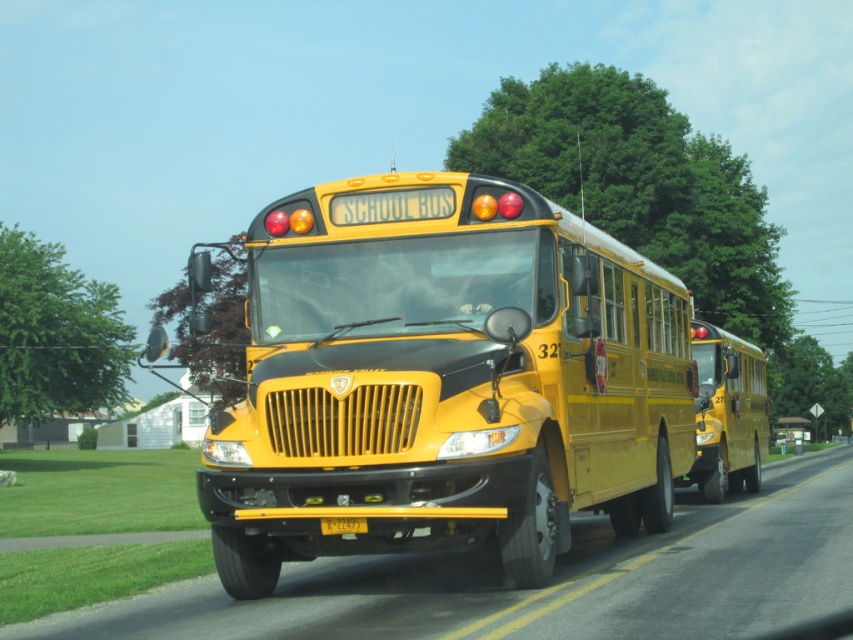
Question: Is yellow matte/solid school bus at center to the right of yellow matte school bus at center from the viewer's perspective?

Choices:
 (A) no
 (B) yes

Answer: (A)

Question: Which point is farther from the camera taking this photo?

Choices:
 (A) (323, 248)
 (B) (322, 522)

Answer: (A)

Question: Which is nearer to the yellow matte/solid school bus at center?

Choices:
 (A) yellow matte license plate at center
 (B) yellow matte school bus at center

Answer: (A)

Question: Is the position of yellow matte/solid school bus at center less distant than that of yellow matte license plate at center?

Choices:
 (A) no
 (B) yes

Answer: (B)

Question: Which object appears farthest from the camera in this image?

Choices:
 (A) yellow matte/solid school bus at center
 (B) yellow matte school bus at center
 (C) yellow matte license plate at center

Answer: (C)

Question: Does yellow matte/solid school bus at center come behind yellow matte license plate at center?

Choices:
 (A) no
 (B) yes

Answer: (A)